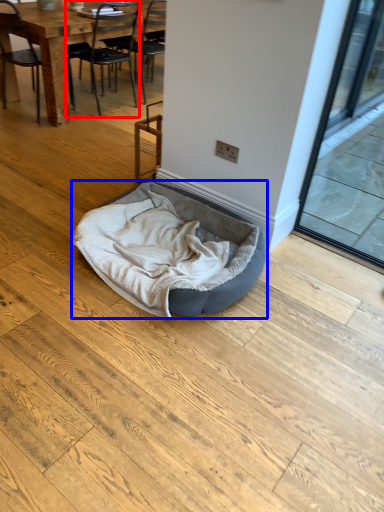
Question: Which of the following is the farthest to the observer, chair (highlighted by a red box) or dog bed (highlighted by a blue box)?

Choices:
 (A) chair
 (B) dog bed

Answer: (A)